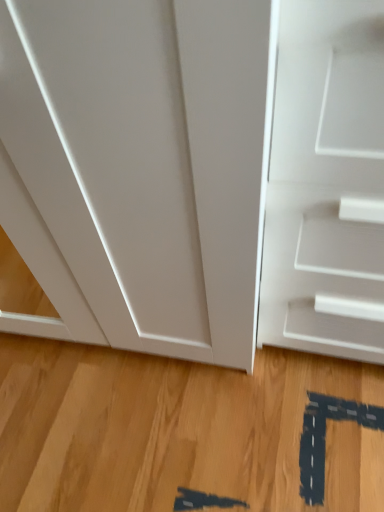
Question: Is white matte door at right spatially inside light brown wood flooring at center, or outside of it?

Choices:
 (A) inside
 (B) outside

Answer: (B)

Question: Looking at the image, does white matte door at right seem bigger or smaller compared to light brown wood flooring at center?

Choices:
 (A) small
 (B) big

Answer: (B)

Question: Visually, is white matte door at right positioned to the left or to the right of light brown wood flooring at center?

Choices:
 (A) left
 (B) right

Answer: (B)

Question: Looking at their shapes, would you say light brown wood flooring at center is wider or thinner than white matte door at right?

Choices:
 (A) thin
 (B) wide

Answer: (B)

Question: Is light brown wood flooring at center taller or shorter than white matte door at right?

Choices:
 (A) tall
 (B) short

Answer: (B)

Question: From a real-world perspective, is light brown wood flooring at center positioned above or below white matte door at right?

Choices:
 (A) above
 (B) below

Answer: (B)

Question: From the image's perspective, is light brown wood flooring at center positioned above or below white matte door at right?

Choices:
 (A) above
 (B) below

Answer: (B)